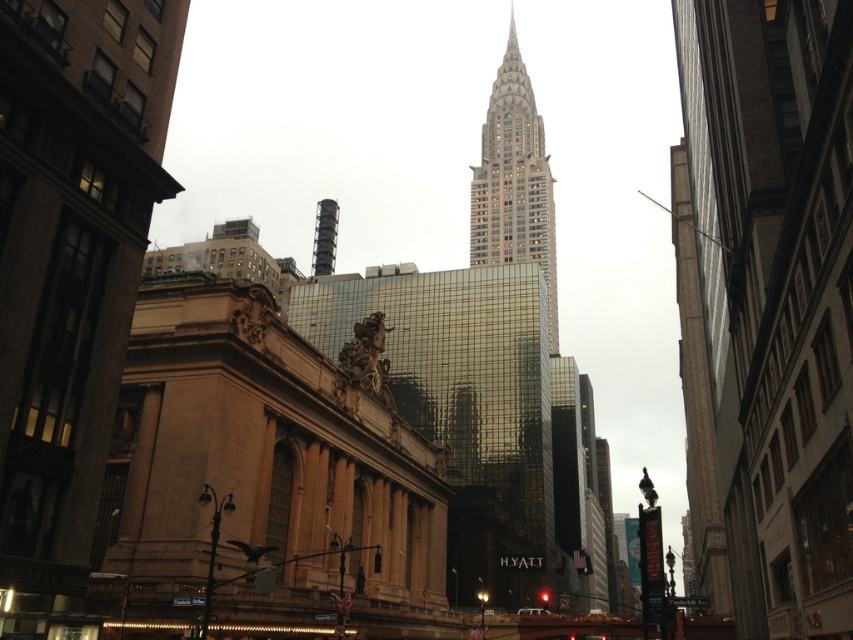
Question: From the image, what is the correct spatial relationship of gray stone tower at center in relation to black concrete chimney at center?

Choices:
 (A) below
 (B) above

Answer: (B)

Question: Can you confirm if gray stone tower at center is thinner than black concrete chimney at center?

Choices:
 (A) no
 (B) yes

Answer: (A)

Question: Does gray stone tower at center lie behind black concrete chimney at center?

Choices:
 (A) no
 (B) yes

Answer: (B)

Question: Which point is closer to the camera?

Choices:
 (A) (527, 160)
 (B) (335, 246)

Answer: (B)